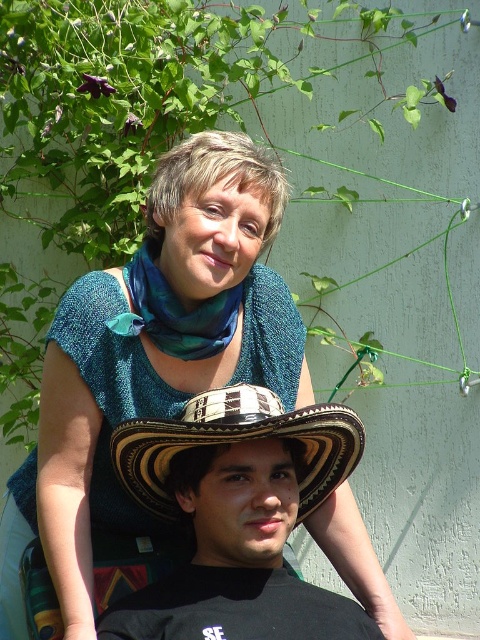
You are trying to decide which item to take with you for a quick trip. You can only choose between the teal textured sweater at upper center and the brown woven straw cowboy hat at center. Based on their sizes, which one would you choose if you want something wider?

The teal textured sweater at upper center might be wider than brown woven straw cowboy hat at center, so you should choose the teal textured sweater at upper center if you want something wider.

You are a photographer trying to capture a closeup of the teal textured sweater at upper center. Based on the scene description, where should you focus your camera to ensure the sweater is in the center of the frame?

The teal textured sweater at upper center is located at point [154,353], so you should focus your camera at those coordinates to center it in the frame.